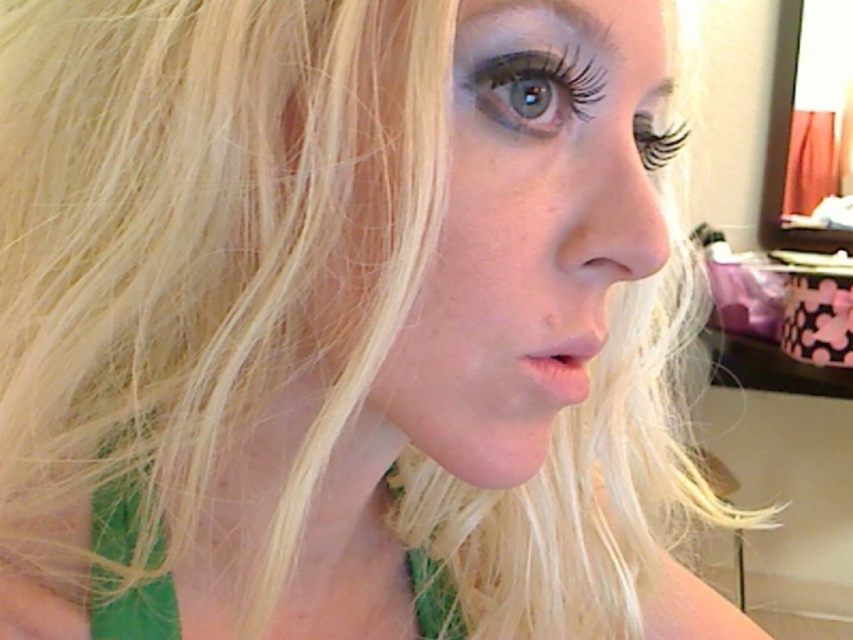
Identify the location of green matte eye at upper center. (531, 84).

Is green matte eye at upper center to the left of black matte eyelashes at upper right from the viewer's perspective?

Correct, you'll find green matte eye at upper center to the left of black matte eyelashes at upper right.

Measure the distance between point (514, 118) and camera.

Point (514, 118) is 11.18 inches away from camera.

What are the coordinates of `green matte eye at upper center` in the screenshot? It's located at (531, 84).

Is dark brown hair at upper center positioned at the back of green matte eye at upper center?

No, it is in front of green matte eye at upper center.

Does dark brown hair at upper center appear on the left side of green matte eye at upper center?

In fact, dark brown hair at upper center is to the right of green matte eye at upper center.

Is point (581, 36) more distant than point (553, 84)?

No, it is not.

This screenshot has width=853, height=640. I want to click on dark brown hair at upper center, so click(544, 36).

Who is taller, smooth skin face at center or green matte eye at upper center?

smooth skin face at center

Can you confirm if smooth skin face at center is thinner than green matte eye at upper center?

Incorrect, smooth skin face at center's width is not less than green matte eye at upper center's.

Describe the element at coordinates (521, 237) in the screenshot. I see `smooth skin face at center` at that location.

This screenshot has height=640, width=853. Identify the location of smooth skin face at center. (521, 237).